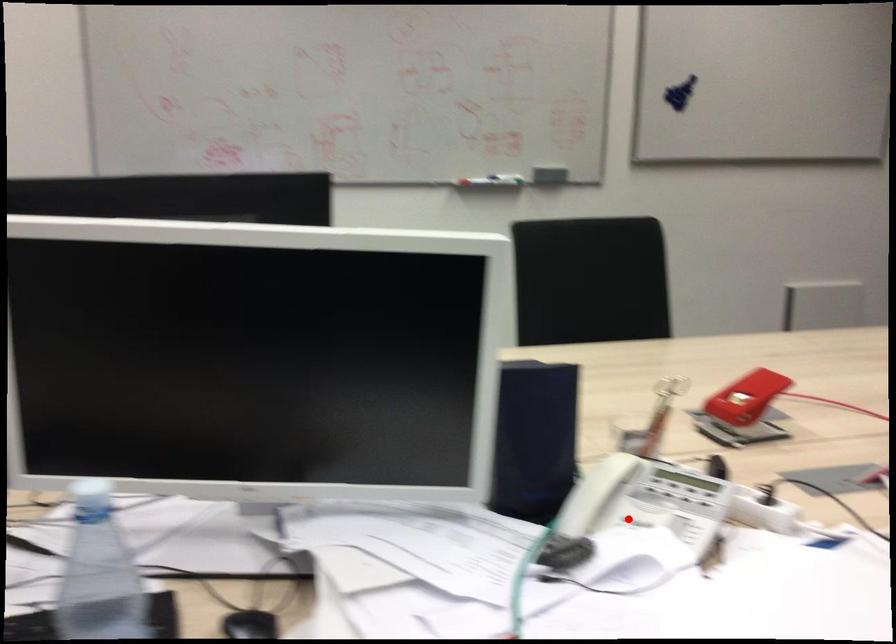
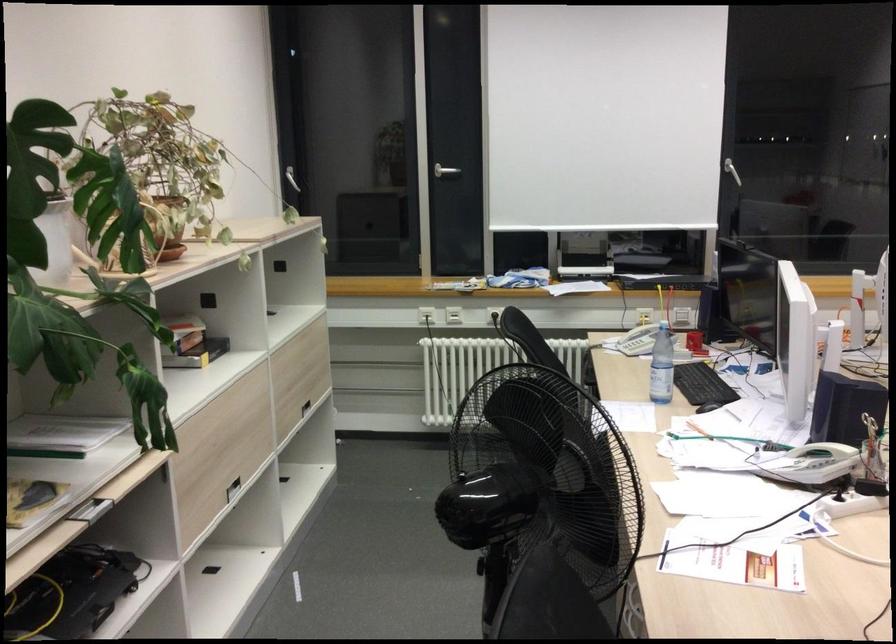
In the second image, find the point that corresponds to the highlighted location in the first image.

(814, 464)